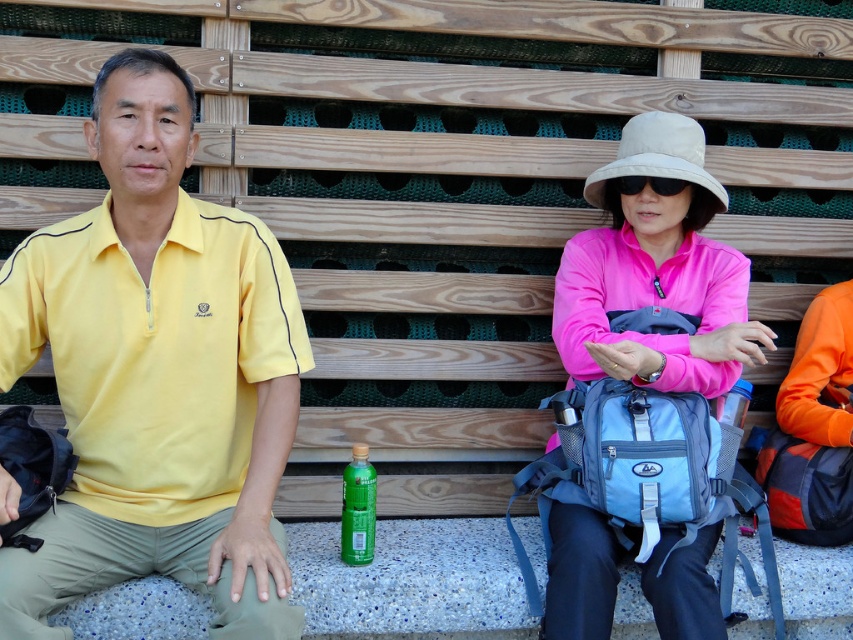
Question: Does pink satin hat at upper center appear on the left side of green matte bottle at center?

Choices:
 (A) yes
 (B) no

Answer: (B)

Question: Among these points, which one is farthest from the camera?

Choices:
 (A) (91, 420)
 (B) (363, 536)
 (C) (583, 340)

Answer: (C)

Question: Which point appears closest to the camera in this image?

Choices:
 (A) (238, 470)
 (B) (364, 477)
 (C) (741, 296)

Answer: (A)

Question: Among these objects, which one is farthest from the camera?

Choices:
 (A) green matte bottle at center
 (B) yellow matte shirt at left
 (C) pink satin hat at upper center

Answer: (A)

Question: Can you confirm if yellow matte shirt at left is positioned to the right of pink satin hat at upper center?

Choices:
 (A) yes
 (B) no

Answer: (B)

Question: Does yellow matte shirt at left appear over green matte bottle at center?

Choices:
 (A) yes
 (B) no

Answer: (A)